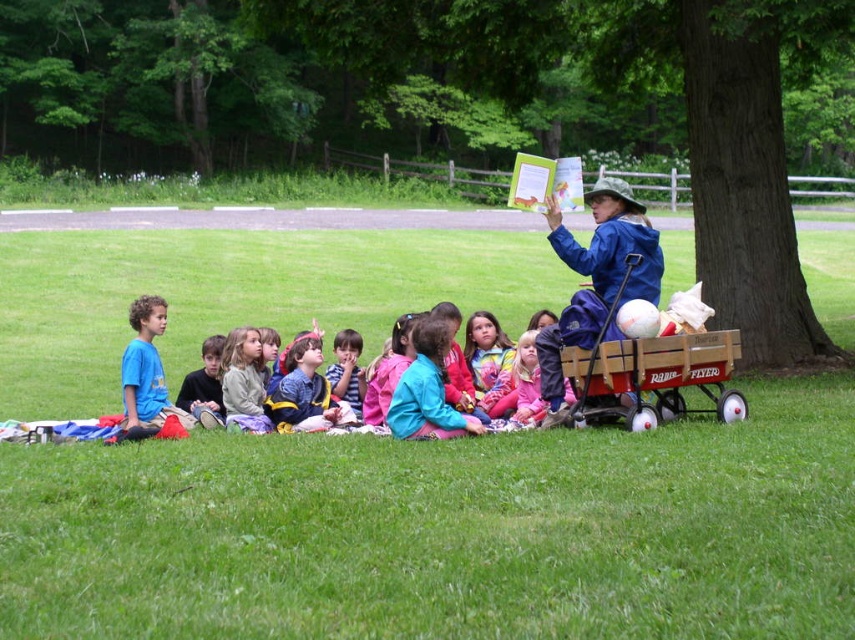
You are standing at the point labeled point (445, 531) in the image. What is the surface you are standing on?

The surface at point (445, 531) is green grass at lower center.

You are a photographer standing in the park scene. You want to take a photo of the green grass at lower center and the green rough bark tree at center right. Which object should you focus on first if you want to capture both in one shot without moving the camera?

You should focus on the green grass at lower center first because it is closer to you than the green rough bark tree at center right, allowing both to be in the frame without moving the camera.

You are a parent trying to locate your child who is wearing a blue cotton shirt at center. You see the wooden wagon at right in the distance. Which direction should you walk to find your child?

You should walk to the left towards the blue cotton shirt at center because the wooden wagon at right is to the right of the blue cotton shirt at center, meaning the shirt is to the left of the wagon.